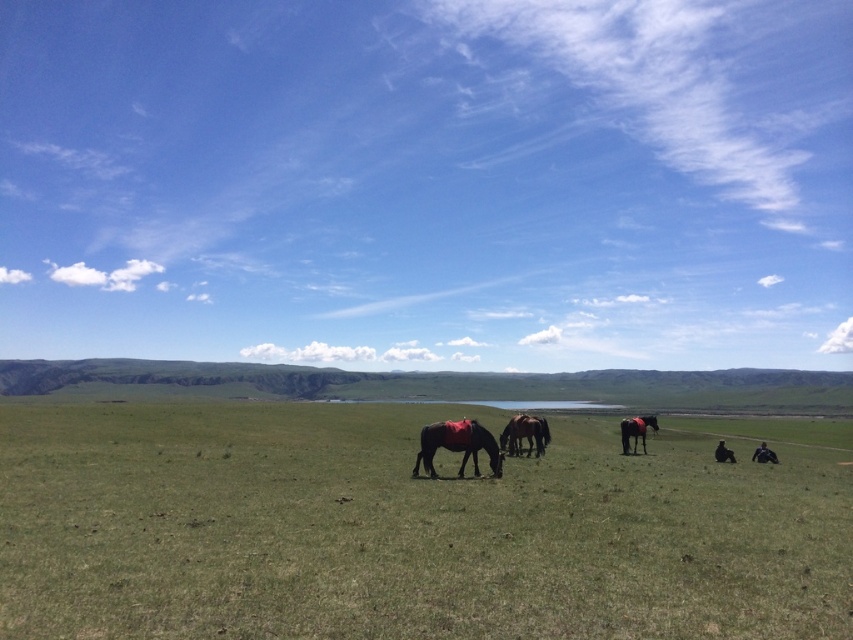
You are a photographer planning to take a photo of the dark brown glossy horse at center and the shiny brown horse at lower right. Based on their sizes in the image, which horse should you focus on first if you want to include both in the frame without cropping either?

The dark brown glossy horse at center is smaller than the shiny brown horse at lower right, so you should focus on the shiny brown horse at lower right first to ensure it fits properly in the frame.

You are standing in the middle of the grassy plain and want to walk towards the two points marked in the image. Which point, point [635,516] or point [460,433], will you reach first?

Point [635,516] is closer to the camera than point [460,433], so you will reach point [635,516] first.

You are standing at the point with coordinates point (524, 435) in the image. What object are you standing on?

You are standing on the dark brown glossy horse at center.